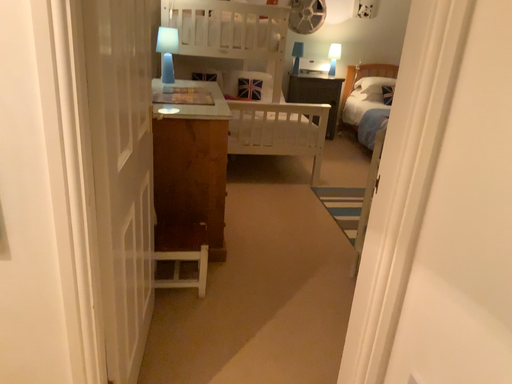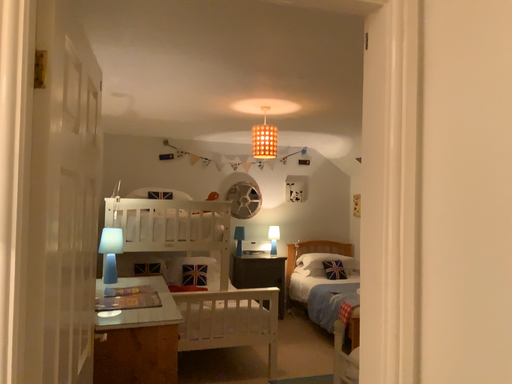
Question: Which way did the camera rotate in the video?

Choices:
 (A) rotated downward
 (B) rotated upward

Answer: (B)